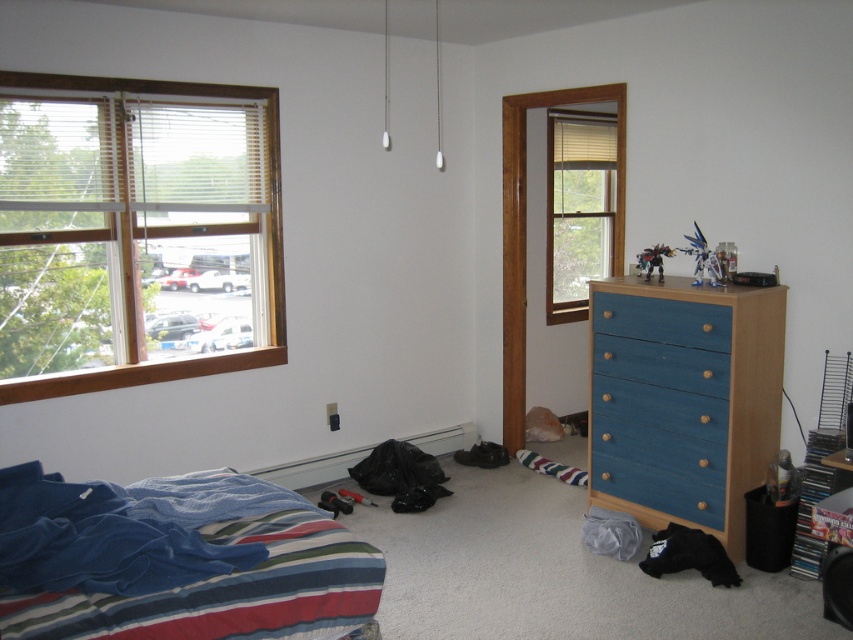
Is the position of blue wood dresser at right more distant than that of matte wood window at center right?

No, blue wood dresser at right is in front of matte wood window at center right.

The width and height of the screenshot is (853, 640). Find the location of `blue wood dresser at right`. blue wood dresser at right is located at coordinates (683, 401).

Where is `blue wood dresser at right`? The height and width of the screenshot is (640, 853). blue wood dresser at right is located at coordinates (683, 401).

Is point (300, 557) positioned after point (561, 148)?

No.

Find the location of a particular element. The image size is (853, 640). blue cotton bedspread at lower left is located at coordinates (175, 561).

Looking at this image, does matte wood window at center right have a smaller size compared to blue painted wood drawer at center right?

No, matte wood window at center right is not smaller than blue painted wood drawer at center right.

Which is below, matte wood window at center right or blue painted wood drawer at center right?

blue painted wood drawer at center right is below.

Which is behind, point (608, 129) or point (703, 339)?

Positioned behind is point (608, 129).

Image resolution: width=853 pixels, height=640 pixels. In order to click on matte wood window at center right in this screenshot , I will do `click(578, 208)`.